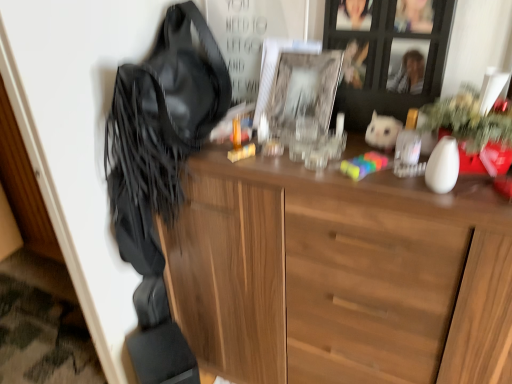
Question: Relative to wooden cabinet at upper center, is white plush toy at upper right in front or behind?

Choices:
 (A) behind
 (B) front

Answer: (A)

Question: Considering the positions of white plush toy at upper right and wooden cabinet at upper center in the image, is white plush toy at upper right wider or thinner than wooden cabinet at upper center?

Choices:
 (A) wide
 (B) thin

Answer: (B)

Question: Based on their relative distances, which object is farther from the wooden cabinet at upper center?

Choices:
 (A) leather fringe at left
 (B) white plush toy at upper right
 (C) clear glass picture frame at center

Answer: (A)

Question: Which is farther from the wooden cabinet at upper center?

Choices:
 (A) leather fringe at left
 (B) white plush toy at upper right
 (C) clear glass picture frame at center

Answer: (A)